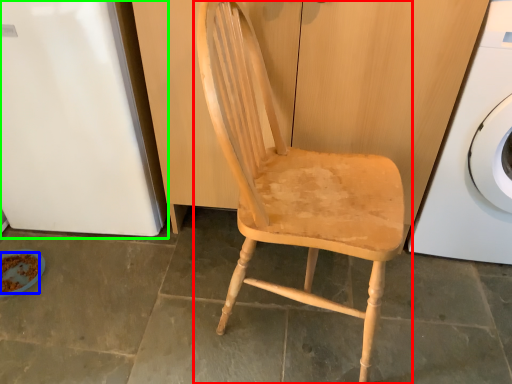
Question: Estimate the real-world distances between objects in this image. Which object is closer to chair (highlighted by a red box), food (highlighted by a blue box) or leftover (highlighted by a green box)?

Choices:
 (A) food
 (B) leftover

Answer: (B)